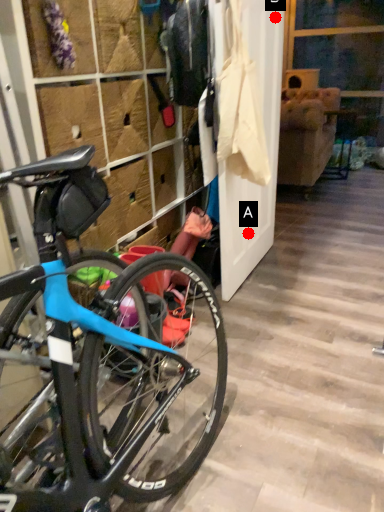
Question: Two points are circled on the image, labeled by A and B beside each circle. Which of the following is the farthest from the observer?

Choices:
 (A) A is further
 (B) B is further

Answer: (A)